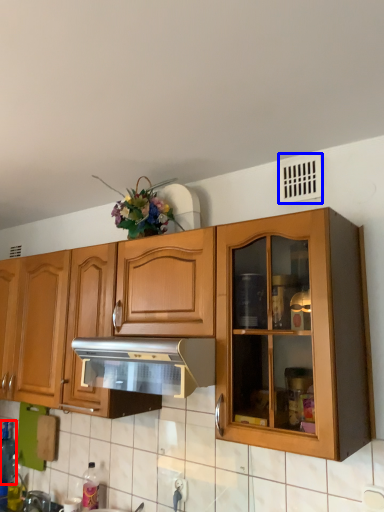
Question: Among these objects, which one is farthest to the camera, bottle (highlighted by a red box) or window (highlighted by a blue box)?

Choices:
 (A) bottle
 (B) window

Answer: (A)